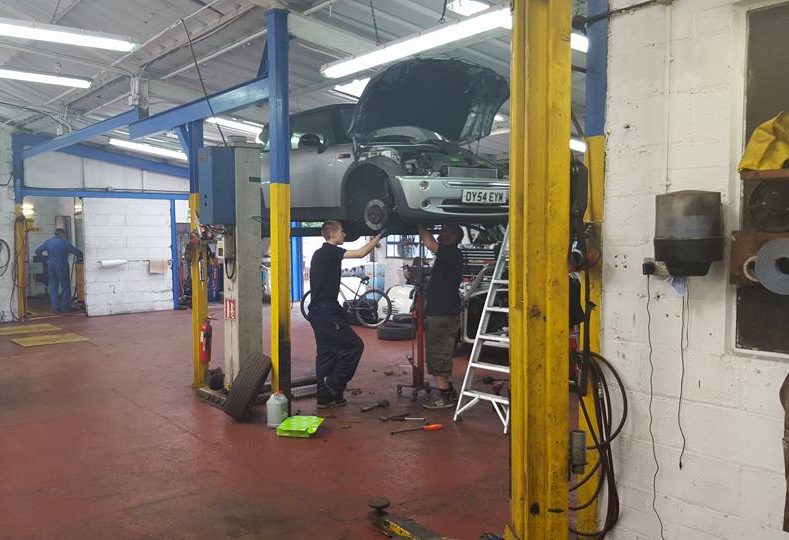
The height and width of the screenshot is (540, 789). Identify the location of greasy floor. (253, 523).